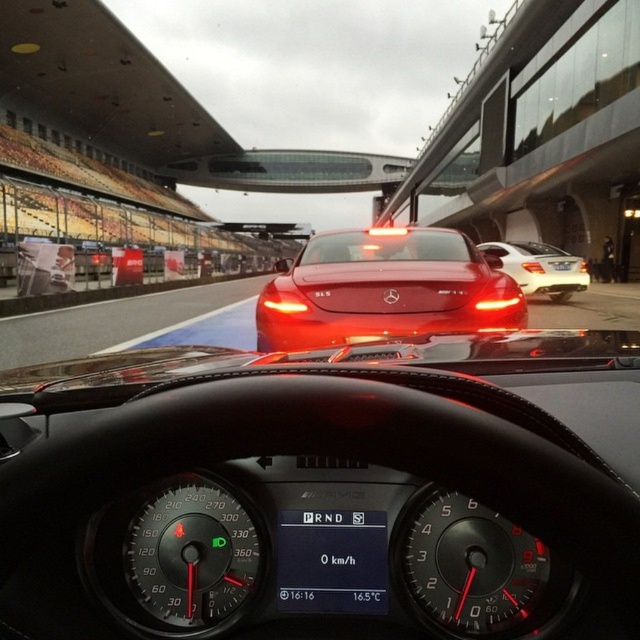
Does shiny red car at center have a smaller size compared to white plastic license plate at center?

No, shiny red car at center is not smaller than white plastic license plate at center.

Is point (400, 324) positioned behind point (378, 564)?

Yes, it is.

At what (x,y) coordinates should I click in order to perform the action: click on shiny red car at center. Please return your answer as a coordinate pair (x, y). The height and width of the screenshot is (640, 640). Looking at the image, I should click on (385, 289).

Where is `smooth asphalt race track at center`? smooth asphalt race track at center is located at coordinates (134, 323).

Locate an element on the screen. smooth asphalt race track at center is located at coordinates pyautogui.click(x=134, y=323).

Find the location of `smooth asphalt race track at center`. smooth asphalt race track at center is located at coordinates (134, 323).

Does white plastic license plate at center lie in front of white glossy sedan at center?

Yes.

Between point (323, 522) and point (516, 262), which one is positioned behind?

The point (516, 262) is more distant.

The width and height of the screenshot is (640, 640). In order to click on white plastic license plate at center in this screenshot , I will do `click(332, 561)`.